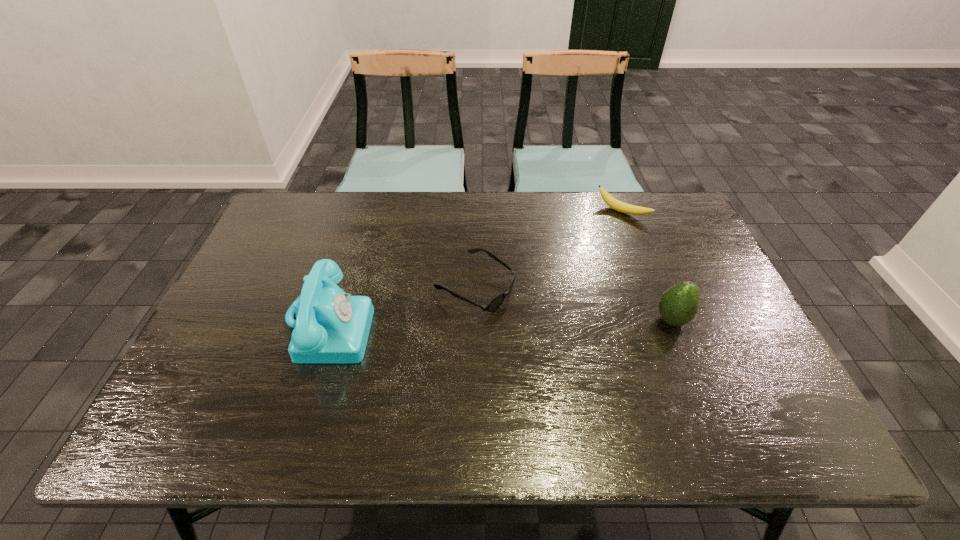
The image size is (960, 540). I want to click on free space located on the upward curve of the banana, so click(548, 291).

Identify the location of vacant area situated 0.390m on the upward curve of the banana. (548, 291).

This screenshot has width=960, height=540. I want to click on free location located on the upward curve of the banana, so click(593, 240).

Locate an element on the screen. Image resolution: width=960 pixels, height=540 pixels. object present at the far edge is located at coordinates (615, 204).

Find the location of a particular element. The height and width of the screenshot is (540, 960). object located at the near edge is located at coordinates (331, 327).

I want to click on avocado at the right edge, so click(x=678, y=305).

The width and height of the screenshot is (960, 540). What are the coordinates of `banana that is at the right edge` in the screenshot? It's located at (615, 204).

Where is `object situated at the far right corner`? The image size is (960, 540). object situated at the far right corner is located at coordinates (615, 204).

You are a GUI agent. You are given a task and a screenshot of the screen. Output one action in this format:
    pyautogui.click(x=<x>, y=<y>)
    Task: Click on the vacant space at the far edge of the desktop
    
    Given the screenshot: What is the action you would take?
    pyautogui.click(x=567, y=192)

You are a GUI agent. You are given a task and a screenshot of the screen. Output one action in this format:
    pyautogui.click(x=<x>, y=<y>)
    Task: Click on the blank space at the near edge of the desktop
    
    Given the screenshot: What is the action you would take?
    pyautogui.click(x=653, y=374)